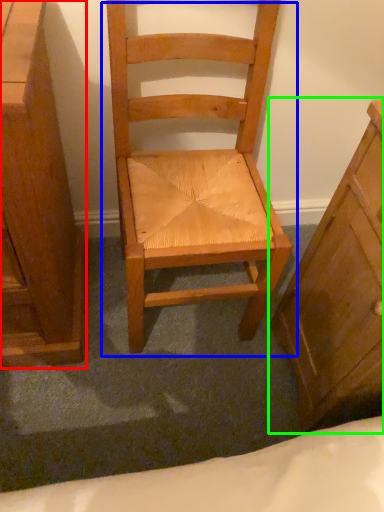
Question: Which object is positioned farthest from chest of drawers (highlighted by a red box)? Select from chair (highlighted by a blue box) and chest of drawers (highlighted by a green box).

Choices:
 (A) chair
 (B) chest of drawers

Answer: (B)